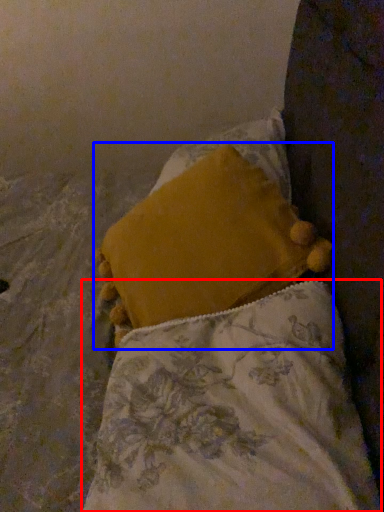
Question: Which point is closer to the camera, pillow (highlighted by a red box) or pillow (highlighted by a blue box)?

Choices:
 (A) pillow
 (B) pillow

Answer: (A)